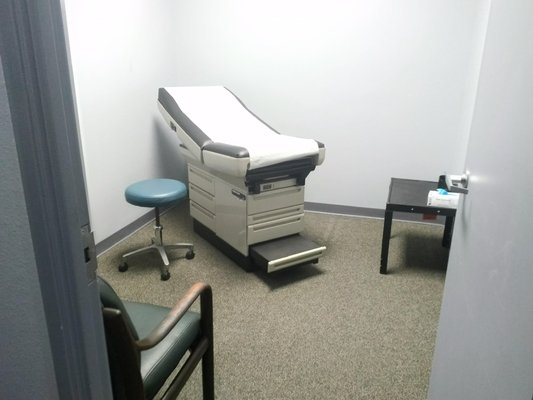
I want to click on padded chair, so tap(148, 321).